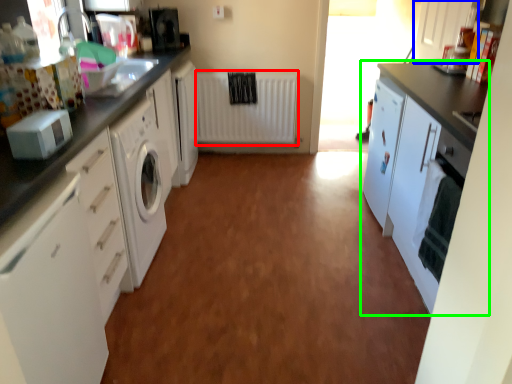
Question: Which object is positioned farthest from radiator (highlighted by a red box)? Select from cabinetry (highlighted by a blue box) and cabinetry (highlighted by a green box).

Choices:
 (A) cabinetry
 (B) cabinetry

Answer: (B)